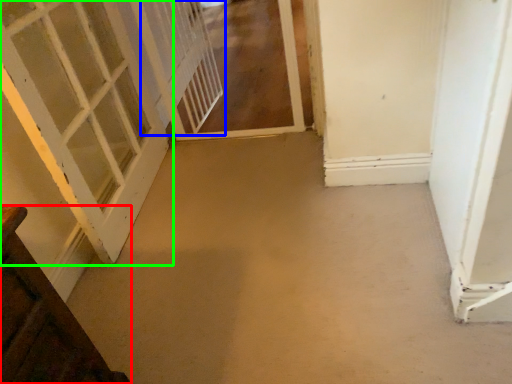
Question: Considering the real-world distances, which object is closest to door (highlighted by a red box)? screen door (highlighted by a blue box) or door (highlighted by a green box).

Choices:
 (A) screen door
 (B) door

Answer: (B)